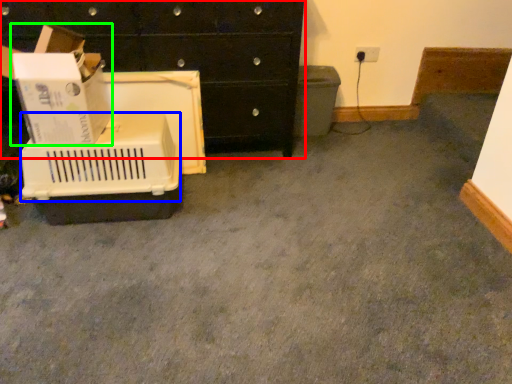
Question: Which object is the farthest from chest of drawers (highlighted by a red box)? Choose among these: basket (highlighted by a blue box) or cardboard box (highlighted by a green box).

Choices:
 (A) basket
 (B) cardboard box

Answer: (A)